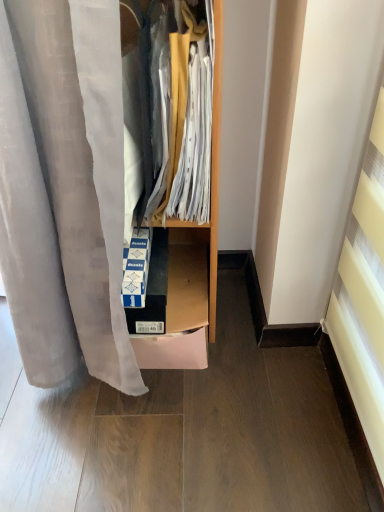
Find the location of a particular element. The height and width of the screenshot is (512, 384). cardboard box at center is located at coordinates (177, 284).

The image size is (384, 512). What do you see at coordinates (177, 284) in the screenshot? I see `cardboard box at center` at bounding box center [177, 284].

Where is `wooden cabinet at center`? Image resolution: width=384 pixels, height=512 pixels. wooden cabinet at center is located at coordinates (198, 234).

Image resolution: width=384 pixels, height=512 pixels. Describe the element at coordinates (198, 234) in the screenshot. I see `wooden cabinet at center` at that location.

Find the location of a particular element. This screenshot has width=384, height=512. cardboard box at center is located at coordinates (177, 284).

Is wooden cabinet at center at the right side of cardboard box at center?

Correct, you'll find wooden cabinet at center to the right of cardboard box at center.

Is wooden cabinet at center in front of cardboard box at center?

Yes, it is.

Considering the points (199, 251) and (203, 296), which point is behind, point (199, 251) or point (203, 296)?

The point (199, 251) is farther from the camera.

From the image's perspective, which is below, wooden cabinet at center or cardboard box at center?

cardboard box at center is shown below in the image.

From a real-world perspective, is wooden cabinet at center on cardboard box at center?

Yes, from a real-world perspective, wooden cabinet at center is above cardboard box at center.

Does wooden cabinet at center have a greater width compared to cardboard box at center?

Incorrect, the width of wooden cabinet at center does not surpass that of cardboard box at center.

Considering the relative sizes of wooden cabinet at center and cardboard box at center in the image provided, is wooden cabinet at center shorter than cardboard box at center?

No.

In the scene shown: Between wooden cabinet at center and cardboard box at center, which one has smaller size?

cardboard box at center is smaller.

Is cardboard box at center completely or partially inside wooden cabinet at center?

Actually, cardboard box at center is outside wooden cabinet at center.

Is wooden cabinet at center next to cardboard box at center and touching it?

Yes.

Is wooden cabinet at center facing away from cardboard box at center?

wooden cabinet at center is not turned away from cardboard box at center.

What's the angular difference between wooden cabinet at center and cardboard box at center's facing directions?

3.4 degrees separate the facing orientations of wooden cabinet at center and cardboard box at center.

Measure the distance from wooden cabinet at center to cardboard box at center.

They are 1.26 inches apart.

This screenshot has height=512, width=384. Identify the location of dresser to the right of cardboard box at center. (198, 234).

Considering the positions of objects cardboard box at center and wooden cabinet at center in the image provided, who is more to the left, cardboard box at center or wooden cabinet at center?

cardboard box at center is more to the left.

Is cardboard box at center positioned in front of wooden cabinet at center?

No, it is behind wooden cabinet at center.

Which is nearer, (x=196, y=234) or (x=191, y=234)?

Clearly, point (x=196, y=234) is closer to the camera than point (x=191, y=234).

From the image's perspective, would you say cardboard box at center is positioned over wooden cabinet at center?

Incorrect, from the image's perspective, cardboard box at center is lower than wooden cabinet at center.

Looking at this image, from a real-world perspective, who is located lower, cardboard box at center or wooden cabinet at center?

cardboard box at center.

Considering the sizes of objects cardboard box at center and wooden cabinet at center in the image provided, who is thinner, cardboard box at center or wooden cabinet at center?

Thinner between the two is wooden cabinet at center.

Does cardboard box at center have a lesser height compared to wooden cabinet at center?

Yes.

Is cardboard box at center smaller than wooden cabinet at center?

Yes, cardboard box at center is smaller than wooden cabinet at center.

Do you think cardboard box at center is within wooden cabinet at center, or outside of it?

cardboard box at center is located beyond the bounds of wooden cabinet at center.

Is cardboard box at center not near wooden cabinet at center?

cardboard box at center is actually quite close to wooden cabinet at center.

Is cardboard box at center facing towards wooden cabinet at center?

No.

What's the angular difference between cardboard box at center and wooden cabinet at center's facing directions?

The angle between the facing direction of cardboard box at center and the facing direction of wooden cabinet at center is 3.4 degrees.

You are a GUI agent. You are given a task and a screenshot of the screen. Output one action in this format:
    pyautogui.click(x=<x>, y=<y>)
    Task: Click on the dresser above the cardboard box at center (from the image's perspective)
    
    Given the screenshot: What is the action you would take?
    pyautogui.click(x=198, y=234)

Image resolution: width=384 pixels, height=512 pixels. I want to click on dresser above the cardboard box at center (from the image's perspective), so click(x=198, y=234).

This screenshot has height=512, width=384. Find the location of `shelf lying below the wooden cabinet at center (from the image's perspective)`. shelf lying below the wooden cabinet at center (from the image's perspective) is located at coordinates (177, 284).